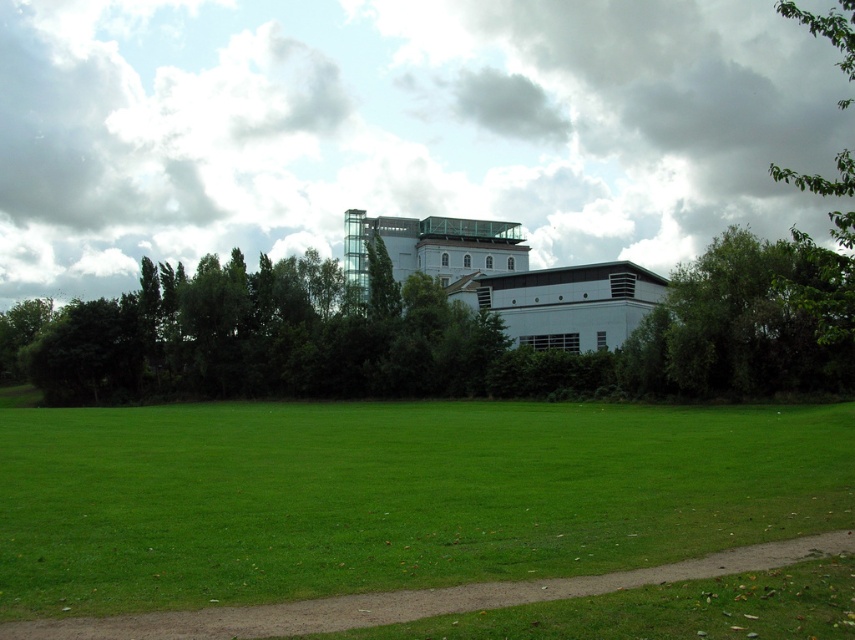
You are standing in front of the large modern building and looking at the two points marked in the image. Which point, point 1 at coordinates [553,589] or point 2 at coordinates [850,172], is closer to you?

Point 1 at coordinates [553,589] is closer to you than point 2 at coordinates [850,172].

You are a gardener planning to mow the green grass at lower center and the brown dirt path at lower center. Which area should you mow first according to their positions?

The green grass at lower center should be mowed first because it is in front of the brown dirt path at lower center, so mowing the grass first avoids accidentally mowing over the dirt path afterward.